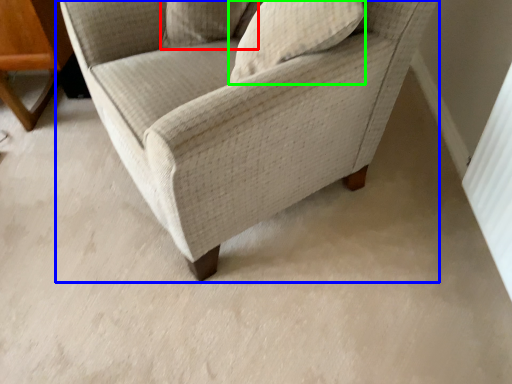
Question: Which is farther away from pillow (highlighted by a red box)? chair (highlighted by a blue box) or pillow (highlighted by a green box)?

Choices:
 (A) chair
 (B) pillow

Answer: (A)